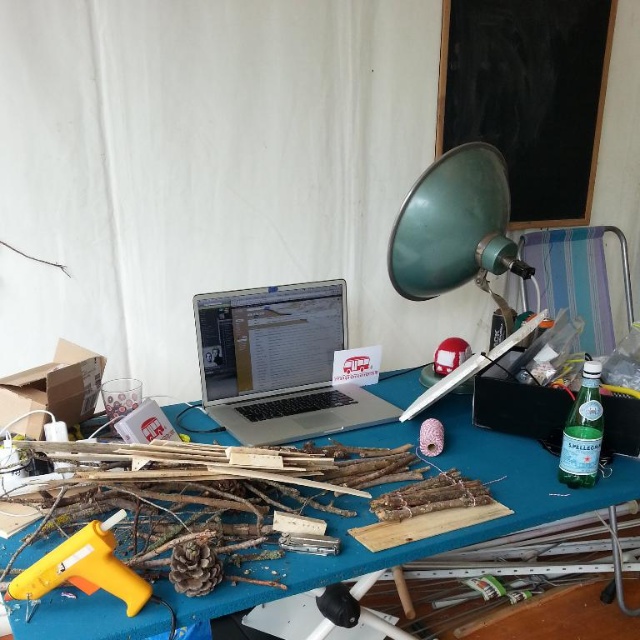
You are organizing the items on the table and need to stack the silver metallic laptop at center and the yellow plastic glue gun at lower left vertically. Which item should be placed at the bottom to ensure stability?

The yellow plastic glue gun at lower left should be placed at the bottom since it is shorter than the silver metallic laptop at center, providing a stable base.

You are organizing a craft fair and need to set up a booth. You have a blue wood table at center and a yellow plastic glue gun at lower left. Which object is higher in height?

The blue wood table at center is taller than the yellow plastic glue gun at lower left.

You are organizing the workspace and need to place a new item between the silver metallic laptop at center and the yellow plastic glue gun at lower left. Can you fit it vertically between them?

The silver metallic laptop at center is above the yellow plastic glue gun at lower left, so there is vertical space between them. You can fit a new item vertically between them.